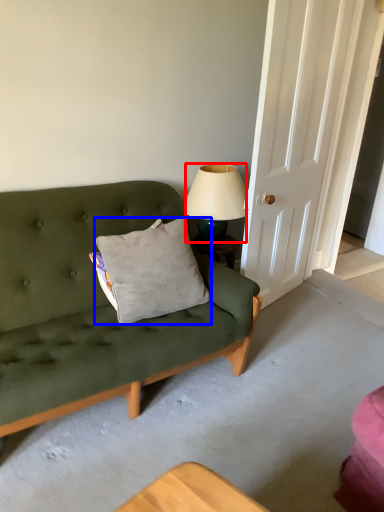
Question: Which point is further to the camera, lamp (highlighted by a red box) or pillow (highlighted by a blue box)?

Choices:
 (A) lamp
 (B) pillow

Answer: (A)